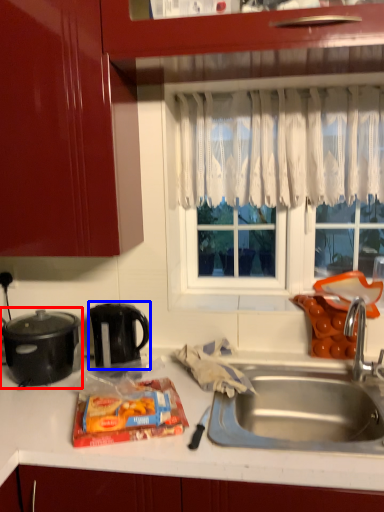
Question: Which point is further to the camera, kitchen appliance (highlighted by a red box) or kitchen appliance (highlighted by a blue box)?

Choices:
 (A) kitchen appliance
 (B) kitchen appliance

Answer: (B)